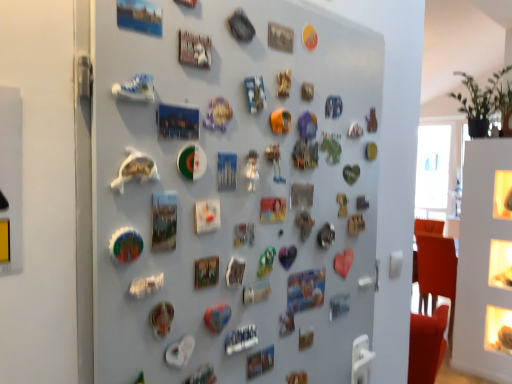
Question: From the image's perspective, relative to metallic fridge magnets at center, is green matte magnet at center, which is the third button in back-to-front order, above or below?

Choices:
 (A) above
 (B) below

Answer: (B)

Question: In terms of height, does green matte magnet at center, which is the third button in back-to-front order, look taller or shorter compared to metallic fridge magnets at center?

Choices:
 (A) tall
 (B) short

Answer: (B)

Question: Based on their relative distances, which object is farther from the matte plastic button at center, the 3th button from the left?

Choices:
 (A) green matte magnet at center, which is the first button in left-to-right order
 (B) metallic fridge magnets at center
 (C) metallic silver button at upper center, acting as the 2th button starting from the back

Answer: (C)

Question: Which object is positioned closest to the green matte magnet at center, which is the first button in left-to-right order?

Choices:
 (A) metallic silver button at upper center, acting as the second button starting from the left
 (B) matte plastic button at center, the 1th button viewed from the right
 (C) metallic fridge magnets at center

Answer: (C)